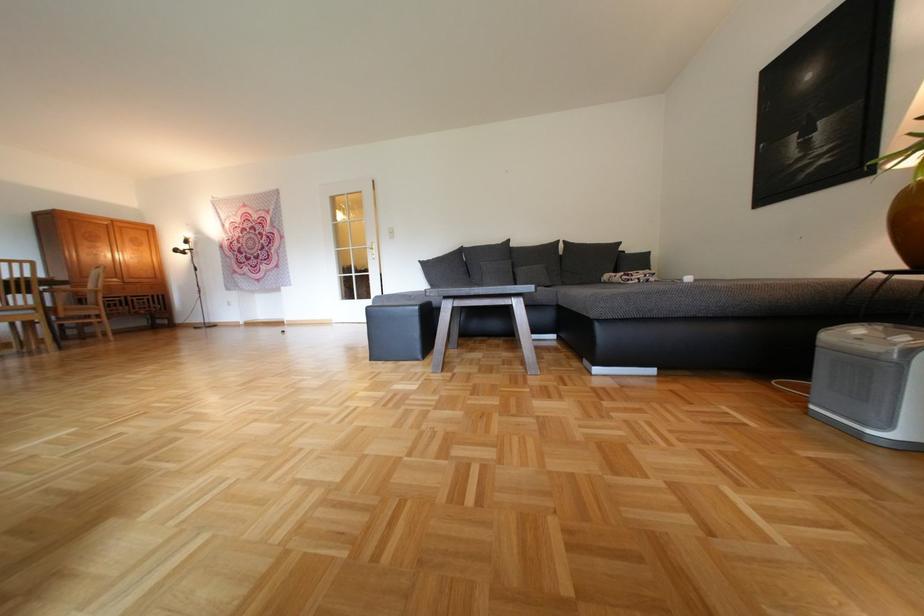
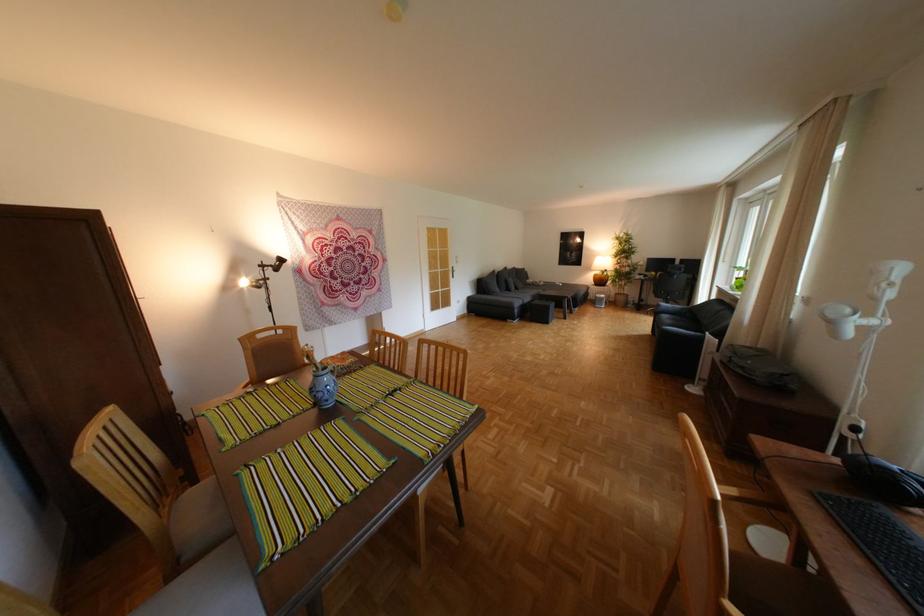
Find the pixel in the second image that matches point 438,259 in the first image.

(496, 278)